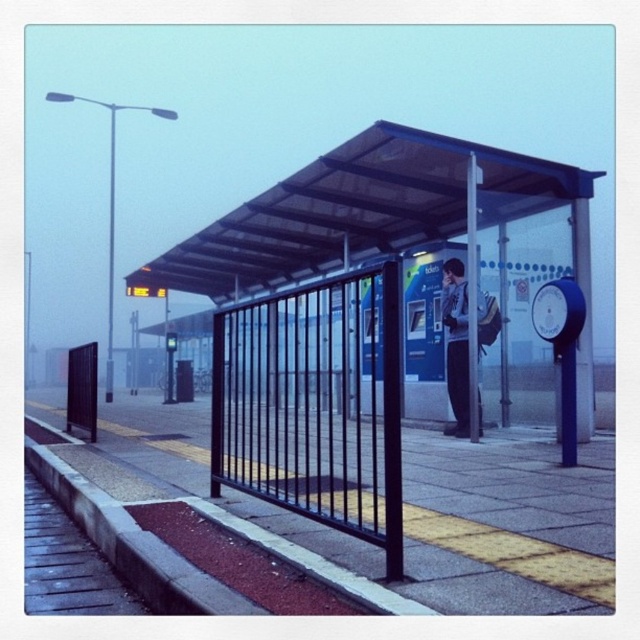
Question: Which point is closer to the camera taking this photo?

Choices:
 (A) coord(214,392)
 (B) coord(413,451)
 (C) coord(96,408)

Answer: (A)

Question: Can you confirm if black metal fence at center is thinner than metallic gray phone box at center?

Choices:
 (A) yes
 (B) no

Answer: (B)

Question: In this image, where is smooth concrete pavement at center located relative to black metal fence at center?

Choices:
 (A) right
 (B) left

Answer: (B)

Question: Which point is closer to the camera?

Choices:
 (A) black metal fence at center
 (B) metallic pole at center
 (C) smooth concrete pavement at center

Answer: (C)

Question: Observing the image, what is the correct spatial positioning of transparent plastic bus station at center in reference to metallic pole at center?

Choices:
 (A) left
 (B) right

Answer: (A)

Question: Among these objects, which one is farthest from the camera?

Choices:
 (A) smooth concrete pavement at center
 (B) transparent plastic bus station at center
 (C) black metal fence at center

Answer: (B)